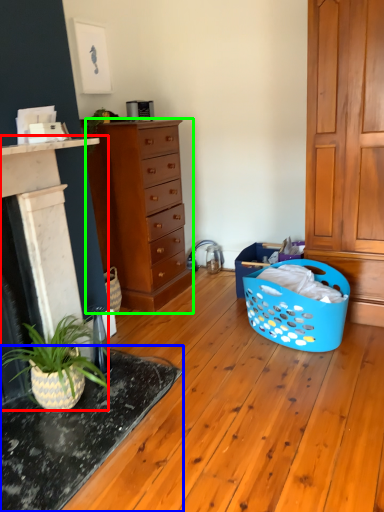
Question: Estimate the real-world distances between objects in this image. Which object is closer to fireplace (highlighted by a red box), table (highlighted by a blue box) or chest of drawers (highlighted by a green box)?

Choices:
 (A) table
 (B) chest of drawers

Answer: (A)